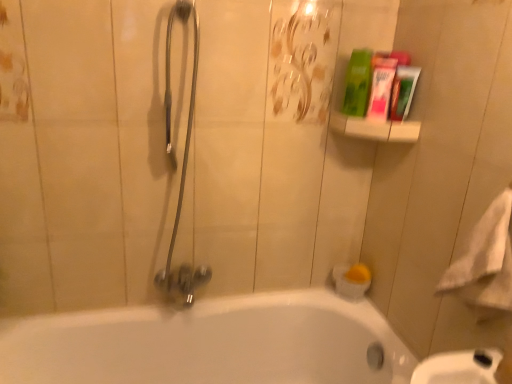
Question: Can you confirm if green matte tube at upper right, which is the 2th mouthwash from left to right, is thinner than white soft towel at right?

Choices:
 (A) no
 (B) yes

Answer: (B)

Question: Is green matte tube at upper right, which is the 2th mouthwash from left to right, far away from white soft towel at right?

Choices:
 (A) no
 (B) yes

Answer: (A)

Question: Is white soft towel at right located within green matte tube at upper right, marked as the 1th mouthwash in a right-to-left arrangement?

Choices:
 (A) no
 (B) yes

Answer: (A)

Question: Is green matte tube at upper right, marked as the 1th mouthwash in a right-to-left arrangement, shorter than white soft towel at right?

Choices:
 (A) no
 (B) yes

Answer: (B)

Question: From a real-world perspective, is green matte tube at upper right, which is the 2th mouthwash from left to right, located beneath white soft towel at right?

Choices:
 (A) no
 (B) yes

Answer: (A)

Question: Is green matte box at upper right in front of or behind green matte tube at upper right, marked as the 1th mouthwash in a right-to-left arrangement, in the image?

Choices:
 (A) front
 (B) behind

Answer: (B)

Question: In terms of width, does green matte box at upper right look wider or thinner when compared to green matte tube at upper right, which is the 2th mouthwash from left to right?

Choices:
 (A) thin
 (B) wide

Answer: (B)

Question: From a real-world perspective, relative to green matte tube at upper right, marked as the 1th mouthwash in a right-to-left arrangement, is green matte box at upper right vertically above or below?

Choices:
 (A) below
 (B) above

Answer: (B)

Question: Is green matte box at upper right situated inside green matte tube at upper right, marked as the 1th mouthwash in a right-to-left arrangement, or outside?

Choices:
 (A) inside
 (B) outside

Answer: (B)

Question: In the image, is white soft towel at right positioned in front of or behind white glossy bathtub at lower center?

Choices:
 (A) front
 (B) behind

Answer: (A)

Question: Is white soft towel at right bigger or smaller than white glossy bathtub at lower center?

Choices:
 (A) small
 (B) big

Answer: (A)

Question: Visually, is white soft towel at right positioned to the left or to the right of white glossy bathtub at lower center?

Choices:
 (A) left
 (B) right

Answer: (B)

Question: From a real-world perspective, is white soft towel at right above or below white glossy bathtub at lower center?

Choices:
 (A) above
 (B) below

Answer: (A)

Question: From their relative heights in the image, would you say satin silver shower head at center left is taller or shorter than green matte box at upper right?

Choices:
 (A) tall
 (B) short

Answer: (A)

Question: From the image's perspective, is satin silver shower head at center left located above or below green matte box at upper right?

Choices:
 (A) above
 (B) below

Answer: (B)